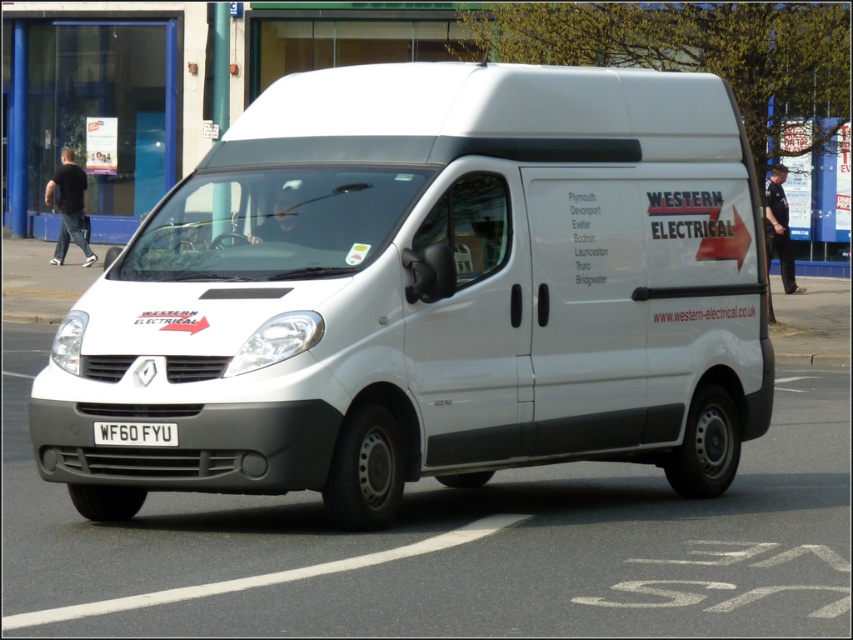
Question: Which object is farther from the camera taking this photo?

Choices:
 (A) white matte van at center
 (B) white metallic license plate at center

Answer: (B)

Question: Does white matte van at center lie in front of white metallic license plate at center?

Choices:
 (A) yes
 (B) no

Answer: (A)

Question: Does white matte van at center lie behind white metallic license plate at center?

Choices:
 (A) no
 (B) yes

Answer: (A)

Question: Which object appears farthest from the camera in this image?

Choices:
 (A) white metallic license plate at center
 (B) white matte van at center

Answer: (A)

Question: Can you confirm if white matte van at center is positioned to the left of white metallic license plate at center?

Choices:
 (A) yes
 (B) no

Answer: (B)